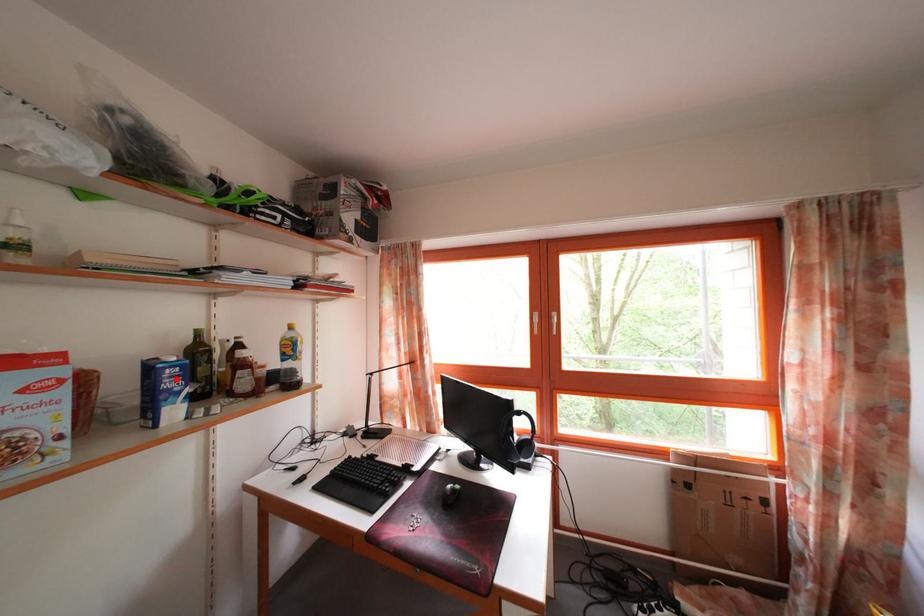
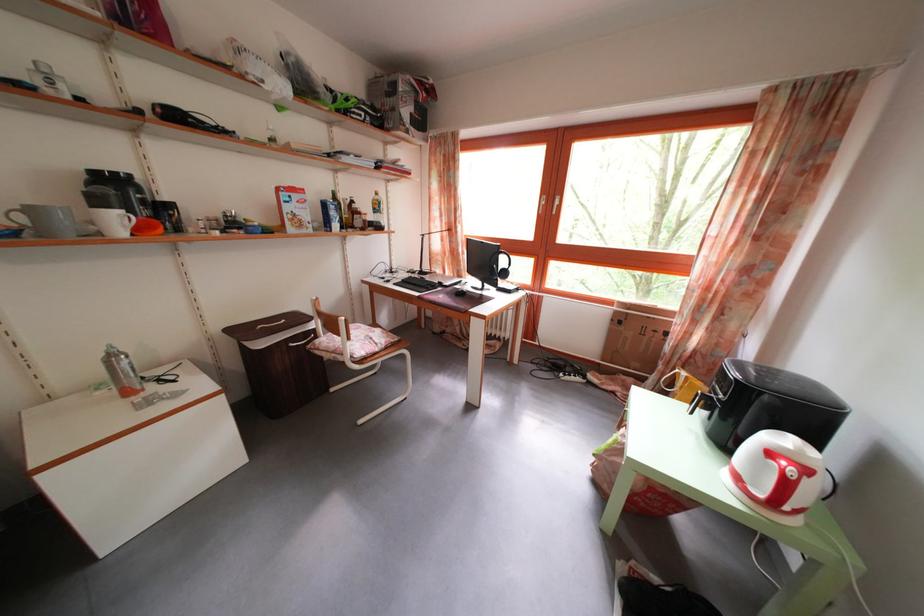
Question: I am providing you with two images of the same scene from different viewpoints. A red point is shown in image1. For the corresponding object point in image2, is it positioned nearer or farther from the camera?

Choices:
 (A) Nearer
 (B) Farther

Answer: (A)